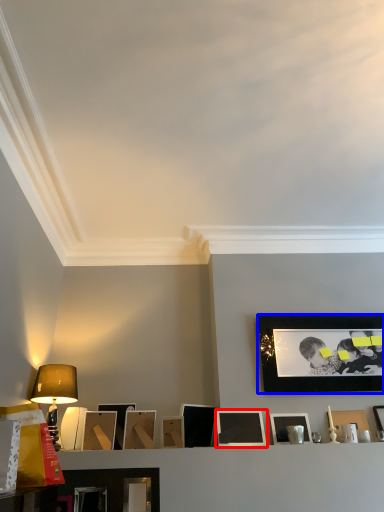
Question: Which of the following is the farthest to the observer, picture frame (highlighted by a red box) or picture frame (highlighted by a blue box)?

Choices:
 (A) picture frame
 (B) picture frame

Answer: (B)